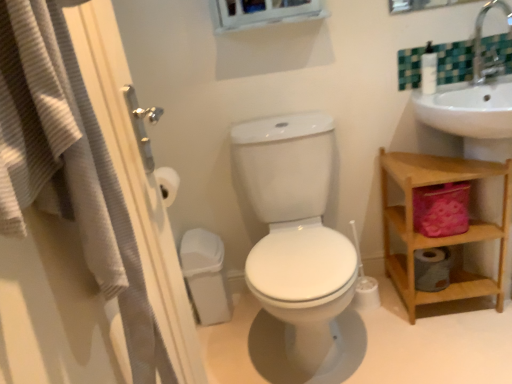
Question: Is wooden shelf at right far from white textured screen door at left?

Choices:
 (A) no
 (B) yes

Answer: (A)

Question: From the image's perspective, would you say wooden shelf at right is positioned over white textured screen door at left?

Choices:
 (A) yes
 (B) no

Answer: (A)

Question: Considering the relative positions of wooden shelf at right and white textured screen door at left in the image provided, is wooden shelf at right to the right of white textured screen door at left from the viewer's perspective?

Choices:
 (A) yes
 (B) no

Answer: (A)

Question: Is wooden shelf at right positioned behind white textured screen door at left?

Choices:
 (A) yes
 (B) no

Answer: (A)

Question: Can you confirm if wooden shelf at right is bigger than white textured screen door at left?

Choices:
 (A) no
 (B) yes

Answer: (B)

Question: Considering their positions, is wooden shelf at right located in front of or behind silver metallic faucet at upper right?

Choices:
 (A) behind
 (B) front

Answer: (B)

Question: Is wooden shelf at right taller or shorter than silver metallic faucet at upper right?

Choices:
 (A) short
 (B) tall

Answer: (B)

Question: Looking at the image, does wooden shelf at right seem bigger or smaller compared to silver metallic faucet at upper right?

Choices:
 (A) small
 (B) big

Answer: (B)

Question: Is point (479, 172) positioned closer to the camera than point (477, 44)?

Choices:
 (A) closer
 (B) farther

Answer: (A)

Question: Looking at their shapes, would you say wooden shelf at right is wider or thinner than white glossy toilet at center?

Choices:
 (A) wide
 (B) thin

Answer: (B)

Question: In the image, is wooden shelf at right positioned in front of or behind white glossy toilet at center?

Choices:
 (A) front
 (B) behind

Answer: (B)

Question: Visually, is wooden shelf at right positioned to the left or to the right of white glossy toilet at center?

Choices:
 (A) left
 (B) right

Answer: (B)

Question: From the image's perspective, relative to white glossy toilet at center, is wooden shelf at right above or below?

Choices:
 (A) above
 (B) below

Answer: (A)

Question: From their relative heights in the image, would you say white glossy toilet at center is taller or shorter than white plastic soap dispenser at upper right?

Choices:
 (A) short
 (B) tall

Answer: (B)

Question: Considering the positions of white glossy toilet at center and white plastic soap dispenser at upper right in the image, is white glossy toilet at center wider or thinner than white plastic soap dispenser at upper right?

Choices:
 (A) wide
 (B) thin

Answer: (A)